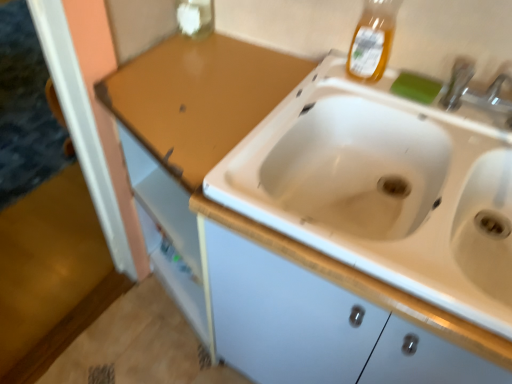
Question: Is translucent amber liquid at upper right, the first bottle when ordered from right to left, a part of transparent glass bottle at upper center, which is the first bottle in left-to-right order?

Choices:
 (A) no
 (B) yes

Answer: (A)

Question: Can we say transparent glass bottle at upper center, the 2th bottle from the right, lies outside translucent amber liquid at upper right, acting as the 2th bottle starting from the back?

Choices:
 (A) no
 (B) yes

Answer: (B)

Question: From a real-world perspective, is transparent glass bottle at upper center, which is the first bottle in left-to-right order, located beneath translucent amber liquid at upper right, the first bottle when ordered from right to left?

Choices:
 (A) yes
 (B) no

Answer: (A)

Question: Is transparent glass bottle at upper center, the 2th bottle in the front-to-back sequence, behind translucent amber liquid at upper right, the first bottle from the front?

Choices:
 (A) yes
 (B) no

Answer: (A)

Question: Does transparent glass bottle at upper center, the 2th bottle from the right, touch translucent amber liquid at upper right, the first bottle when ordered from right to left?

Choices:
 (A) no
 (B) yes

Answer: (A)

Question: Does point (355, 48) appear closer or farther from the camera than point (396, 91)?

Choices:
 (A) closer
 (B) farther

Answer: (A)

Question: Is translucent amber liquid at upper right, which is counted as the second bottle, starting from the left, inside the boundaries of green sponge at upper right, or outside?

Choices:
 (A) outside
 (B) inside

Answer: (A)

Question: Is translucent amber liquid at upper right, which is counted as the second bottle, starting from the left, taller or shorter than green sponge at upper right?

Choices:
 (A) tall
 (B) short

Answer: (A)

Question: Is translucent amber liquid at upper right, acting as the 2th bottle starting from the back, wider or thinner than green sponge at upper right?

Choices:
 (A) thin
 (B) wide

Answer: (B)

Question: Is transparent glass bottle at upper center, the 1th bottle from the back, taller or shorter than translucent amber liquid at upper right, the first bottle when ordered from right to left?

Choices:
 (A) short
 (B) tall

Answer: (A)

Question: Visually, is transparent glass bottle at upper center, which is the first bottle in left-to-right order, positioned to the left or to the right of translucent amber liquid at upper right, the first bottle when ordered from right to left?

Choices:
 (A) left
 (B) right

Answer: (A)

Question: Would you say transparent glass bottle at upper center, which is the first bottle in left-to-right order, is inside or outside translucent amber liquid at upper right, acting as the 2th bottle starting from the back?

Choices:
 (A) outside
 (B) inside

Answer: (A)

Question: Is point (193, 11) closer or farther from the camera than point (357, 21)?

Choices:
 (A) farther
 (B) closer

Answer: (A)

Question: From a real-world perspective, is transparent glass bottle at upper center, the 1th bottle from the back, above or below green sponge at upper right?

Choices:
 (A) above
 (B) below

Answer: (A)

Question: From the image's perspective, is transparent glass bottle at upper center, the 1th bottle from the back, above or below green sponge at upper right?

Choices:
 (A) below
 (B) above

Answer: (B)